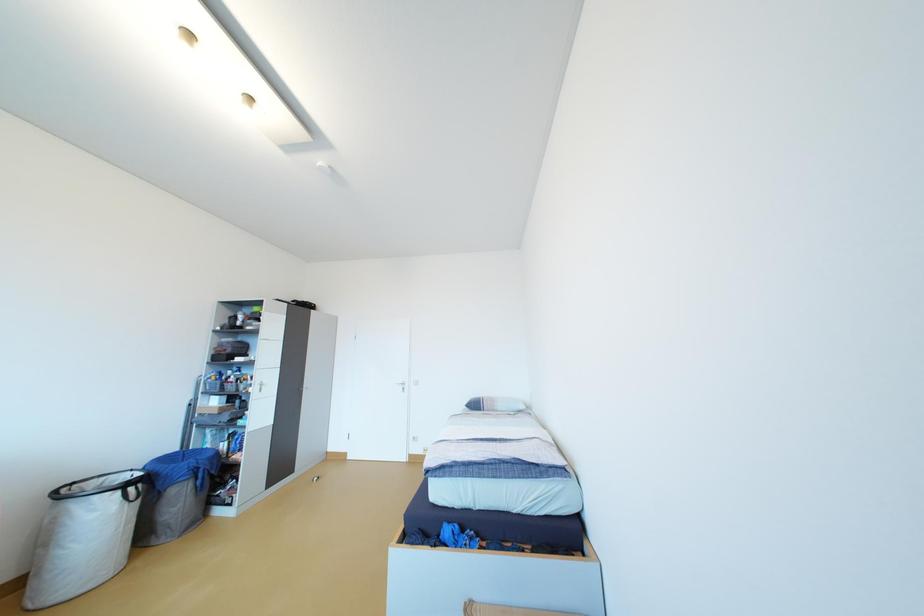
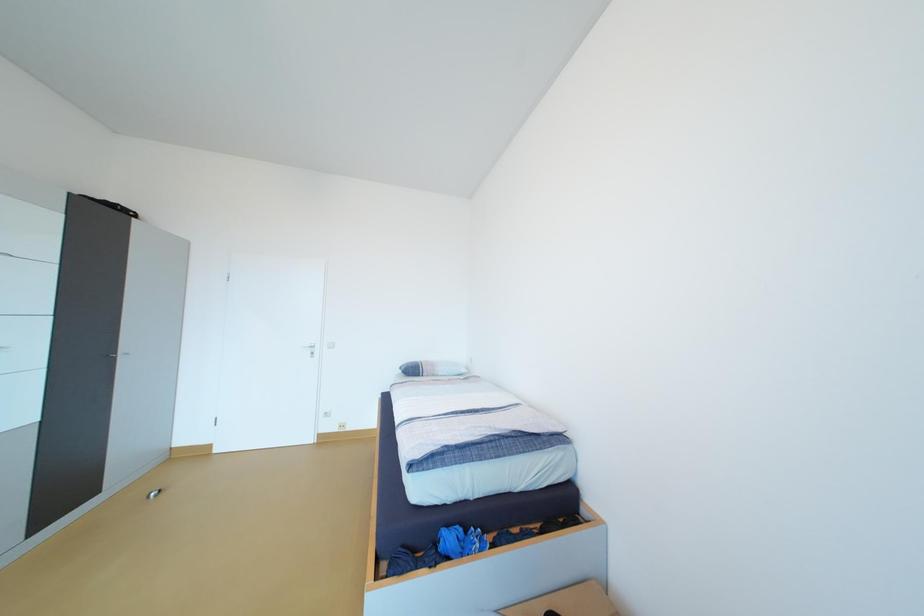
Question: The images are taken continuously from a first-person perspective. In which direction is your viewpoint rotating?

Choices:
 (A) Left
 (B) Right
 (C) Up
 (D) Down

Answer: (B)